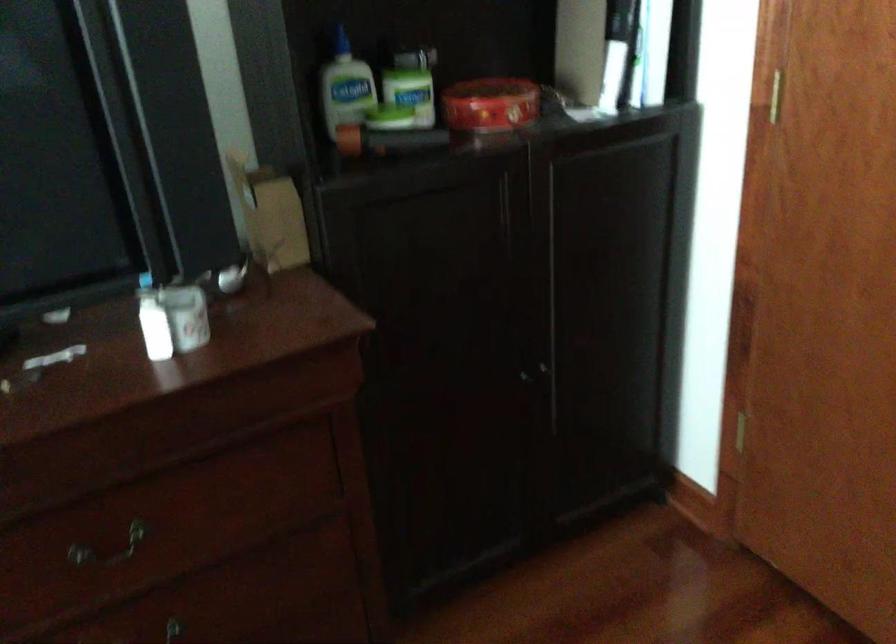
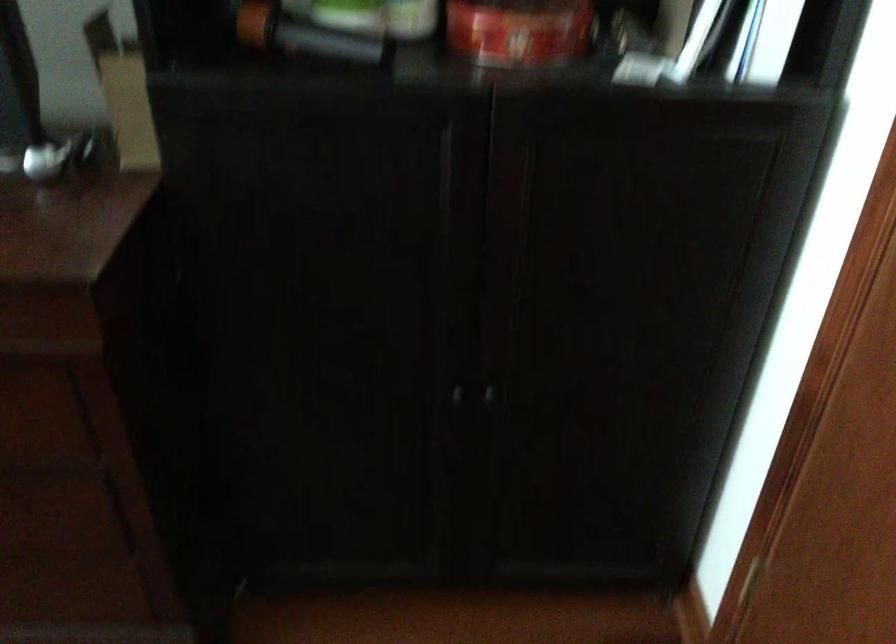
In the second image, find the point that corresponds to the point at 512,113 in the first image.

(519, 31)